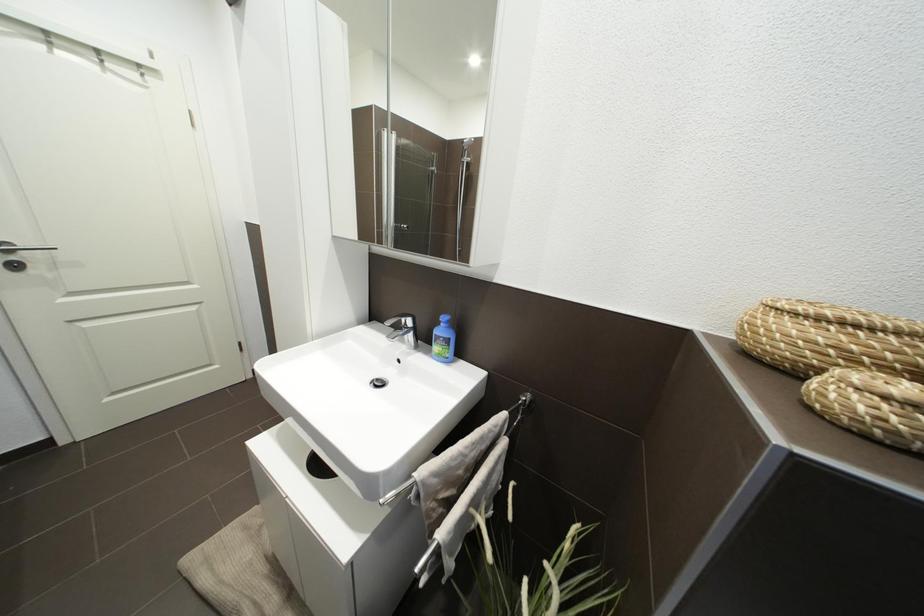
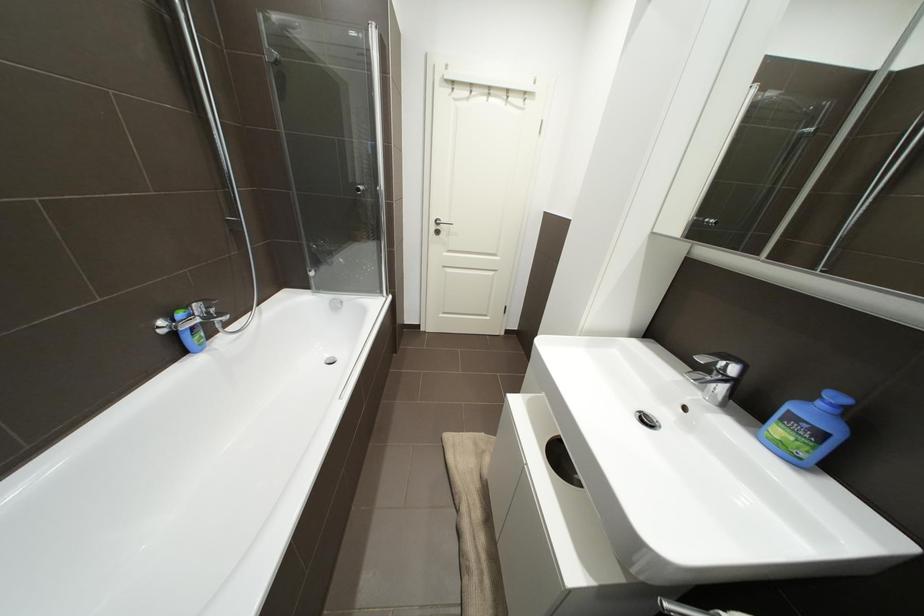
Question: The images are taken continuously from a first-person perspective. In which direction is your viewpoint rotating?

Choices:
 (A) Left
 (B) Right
 (C) Up
 (D) Down

Answer: (A)